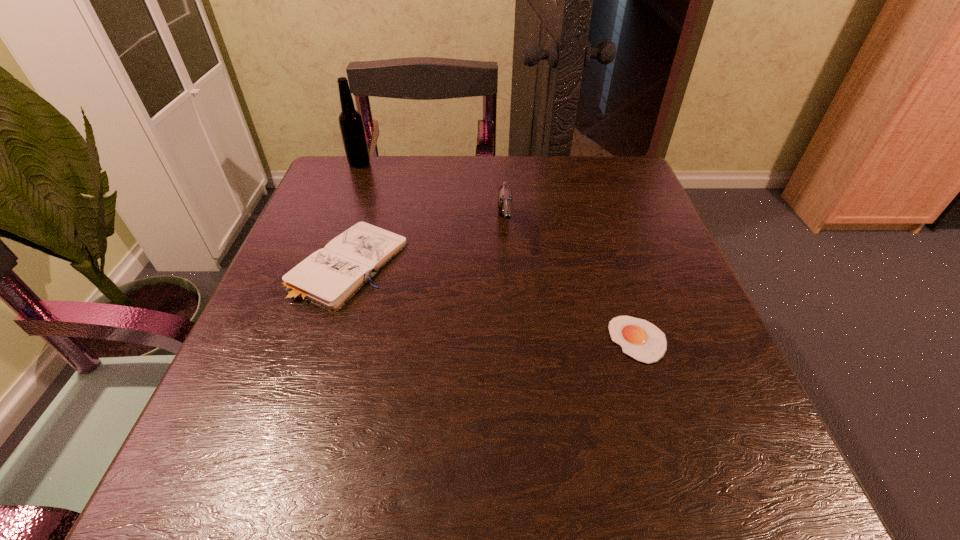
Find the location of a particular element. The height and width of the screenshot is (540, 960). vacant space in between the rightmost object and the notebook is located at coordinates (493, 302).

Identify the location of blank region between the nearest object and the second shortest object. (493, 302).

Identify which object is the nearest to the egg yolk. Please provide its 2D coordinates. Your answer should be formatted as a tuple, i.e. [(x, y)], where the tuple contains the x and y coordinates of a point satisfying the conditions above.

[(505, 198)]

Select which object is the closest to the pistol. Please provide its 2D coordinates. Your answer should be formatted as a tuple, i.e. [(x, y)], where the tuple contains the x and y coordinates of a point satisfying the conditions above.

[(329, 277)]

You are a GUI agent. You are given a task and a screenshot of the screen. Output one action in this format:
    pyautogui.click(x=<x>, y=<y>)
    Task: Click on the vacant space that satisfies the following two spatial constraints: 1. on the front side of the tallest object; 2. on the left side of the third tallest object
    This screenshot has width=960, height=540.
    Given the screenshot: What is the action you would take?
    [x=321, y=264]